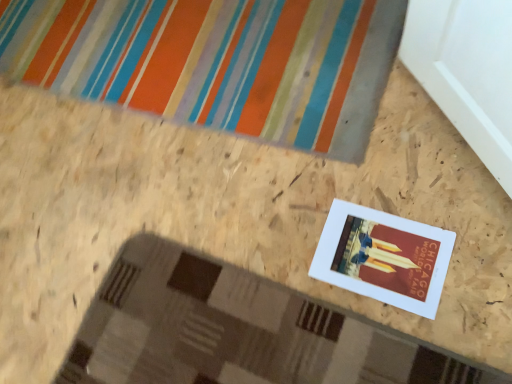
Question: Is point (394, 221) closer or farther from the camera than point (226, 43)?

Choices:
 (A) farther
 (B) closer

Answer: (B)

Question: Is white matte picture frame at center bigger or smaller than multicolored striped bath mat at upper center?

Choices:
 (A) big
 (B) small

Answer: (B)

Question: Is white matte picture frame at center wider or thinner than multicolored striped bath mat at upper center?

Choices:
 (A) wide
 (B) thin

Answer: (B)

Question: In terms of size, does multicolored striped bath mat at upper center appear bigger or smaller than white matte picture frame at center?

Choices:
 (A) small
 (B) big

Answer: (B)

Question: From a real-world perspective, is multicolored striped bath mat at upper center physically located above or below white matte picture frame at center?

Choices:
 (A) above
 (B) below

Answer: (A)

Question: Which is correct: multicolored striped bath mat at upper center is inside white matte picture frame at center, or outside of it?

Choices:
 (A) inside
 (B) outside

Answer: (B)

Question: Considering the positions of point (111, 59) and point (326, 236), is point (111, 59) closer or farther from the camera than point (326, 236)?

Choices:
 (A) farther
 (B) closer

Answer: (A)